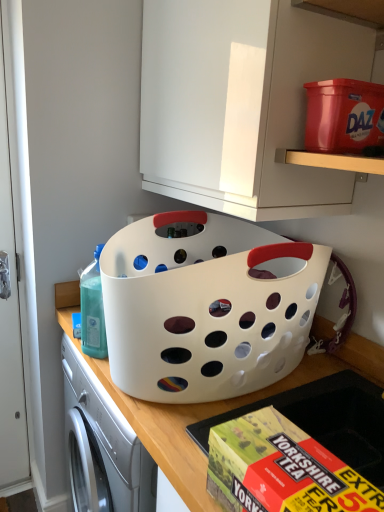
Find the location of a particular element. This screenshot has height=512, width=384. yellow cardboard box at lower center is located at coordinates (281, 469).

Identify the location of white plastic basket at center. (206, 306).

At what (x,y) coordinates should I click in order to perform the action: click on white glossy cabinet at upper center. Please return your answer as a coordinate pair (x, y). The height and width of the screenshot is (512, 384). Looking at the image, I should click on (241, 103).

Which object is closer to the camera taking this photo, white plastic basket at center or yellow cardboard box at lower center?

Positioned in front is yellow cardboard box at lower center.

Based on their positions, is white plastic basket at center located to the left or right of yellow cardboard box at lower center?

white plastic basket at center is to the left of yellow cardboard box at lower center.

From a real-world perspective, is white plastic basket at center positioned above or below yellow cardboard box at lower center?

white plastic basket at center is below yellow cardboard box at lower center.

Does translucent plastic bottle at left have a larger size compared to white plastic basket at center?

Actually, translucent plastic bottle at left might be smaller than white plastic basket at center.

Is translucent plastic bottle at left facing towards white plastic basket at center?

No, translucent plastic bottle at left is not aimed at white plastic basket at center.

Does translucent plastic bottle at left have a greater width compared to white plastic basket at center?

No.

From the picture: From the image's perspective, which object appears higher, translucent plastic bottle at left or white plastic basket at center?

translucent plastic bottle at left.

In the scene shown: Considering the sizes of objects white plastic basket at center and matte plastic storage box at upper right in the image provided, who is thinner, white plastic basket at center or matte plastic storage box at upper right?

matte plastic storage box at upper right.

Considering the positions of objects white plastic basket at center and matte plastic storage box at upper right in the image provided, who is more to the right, white plastic basket at center or matte plastic storage box at upper right?

matte plastic storage box at upper right is more to the right.

From a real-world perspective, is white plastic basket at center under matte plastic storage box at upper right?

Yes, from a real-world perspective, white plastic basket at center is beneath matte plastic storage box at upper right.

Is white plastic basket at center completely or partially outside of matte plastic storage box at upper right?

That's correct, white plastic basket at center is outside of matte plastic storage box at upper right.

From a real-world perspective, is white glossy cabinet at upper center on white plastic basket at center?

Indeed, from a real-world perspective, white glossy cabinet at upper center stands above white plastic basket at center.

Based on the photo, which object is thinner, white glossy cabinet at upper center or white plastic basket at center?

white glossy cabinet at upper center is thinner.

Between white glossy cabinet at upper center and white plastic basket at center, which one appears on the left side from the viewer's perspective?

From the viewer's perspective, white plastic basket at center appears more on the left side.

Is translucent plastic bottle at left positioned with its back to yellow cardboard box at lower center?

translucent plastic bottle at left is not turned away from yellow cardboard box at lower center.

Which is in front, point (98, 322) or point (253, 435)?

The point (253, 435) is closer.

From the picture: Between translucent plastic bottle at left and yellow cardboard box at lower center, which one has smaller width?

translucent plastic bottle at left is thinner.

Would you consider translucent plastic bottle at left to be distant from yellow cardboard box at lower center?

No.

Does white plastic basket at center have a greater width compared to white glossy cabinet at upper center?

Indeed, white plastic basket at center has a greater width compared to white glossy cabinet at upper center.

Is white plastic basket at center far from white glossy cabinet at upper center?

white plastic basket at center is actually quite close to white glossy cabinet at upper center.

Could you tell me if white plastic basket at center is turned towards white glossy cabinet at upper center?

No.

Consider the image. Which object is wider, white plastic basket at center or translucent plastic bottle at left?

With larger width is white plastic basket at center.

Does point (152, 428) come farther from viewer compared to point (97, 309)?

That is False.

Is there a large distance between white plastic basket at center and translucent plastic bottle at left?

No.

Locate an element on the screen. This screenshot has height=512, width=384. box above the white plastic basket at center (from a real-world perspective) is located at coordinates (281, 469).

Where is `cleaning product behind the white plastic basket at center`? The height and width of the screenshot is (512, 384). cleaning product behind the white plastic basket at center is located at coordinates (92, 310).

Looking at the image, which one is located closer to white glossy cabinet at upper center, matte plastic storage box at upper right or white plastic basket at center?

The object closer to white glossy cabinet at upper center is matte plastic storage box at upper right.

From the image, which object appears to be nearer to matte plastic storage box at upper right, white plastic basket at center or white plastic basket at center?

white plastic basket at center is positioned closer to the anchor matte plastic storage box at upper right.

Considering their positions, is white glossy cabinet at upper center positioned further to matte plastic storage box at upper right than white plastic basket at center?

white plastic basket at center is further to matte plastic storage box at upper right.

From the image, which object appears to be nearer to translucent plastic bottle at left, white glossy cabinet at upper center or matte plastic storage box at upper right?

white glossy cabinet at upper center is positioned closer to the anchor translucent plastic bottle at left.

From the image, which object appears to be nearer to white glossy cabinet at upper center, white plastic basket at center or white plastic basket at center?

The object closer to white glossy cabinet at upper center is white plastic basket at center.

Looking at the image, which one is located closer to yellow cardboard box at lower center, white plastic basket at center or white plastic basket at center?

white plastic basket at center is closer to yellow cardboard box at lower center.

Which object lies further to the anchor point yellow cardboard box at lower center, white plastic basket at center or white plastic basket at center?

white plastic basket at center is positioned further to the anchor yellow cardboard box at lower center.

When comparing their distances from matte plastic storage box at upper right, does translucent plastic bottle at left or white plastic basket at center seem further?

The object further to matte plastic storage box at upper right is translucent plastic bottle at left.

Where is `storage box between white glossy cabinet at upper center and yellow cardboard box at lower center in the up-down direction`? storage box between white glossy cabinet at upper center and yellow cardboard box at lower center in the up-down direction is located at coordinates (344, 116).

Where is `basket between matte plastic storage box at upper right and white plastic basket at center in the vertical direction`? basket between matte plastic storage box at upper right and white plastic basket at center in the vertical direction is located at coordinates click(x=206, y=306).

You are a GUI agent. You are given a task and a screenshot of the screen. Output one action in this format:
    pyautogui.click(x=<x>, y=<y>)
    Task: Click on the cleaning product between white glossy cabinet at upper center and yellow cardboard box at lower center in the vertical direction
    Image resolution: width=384 pixels, height=512 pixels.
    Given the screenshot: What is the action you would take?
    pyautogui.click(x=92, y=310)

Locate an element on the screen. This screenshot has height=512, width=384. box between matte plastic storage box at upper right and white plastic basket at center in the up-down direction is located at coordinates (281, 469).